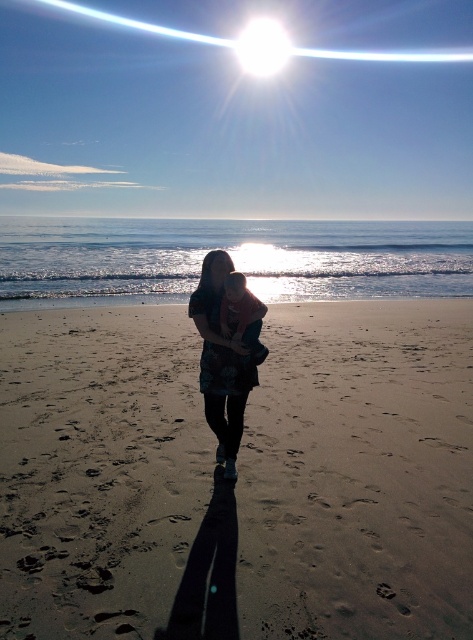
Does sandy brown at center have a greater height compared to matte blue dress at center?

In fact, sandy brown at center may be shorter than matte blue dress at center.

Does sandy brown at center have a larger size compared to matte blue dress at center?

Yes, sandy brown at center is bigger than matte blue dress at center.

At what (x,y) coordinates should I click in order to perform the action: click on sandy brown at center. Please return your answer as a coordinate pair (x, y). The height and width of the screenshot is (640, 473). Looking at the image, I should click on (238, 476).

Which of these two, matte blue dress at center or soft pink fabric baby at center, stands taller?

matte blue dress at center is taller.

Is matte blue dress at center closer to the viewer compared to soft pink fabric baby at center?

That is False.

Measure the distance between matte blue dress at center and camera.

14.74 feet

This screenshot has height=640, width=473. I want to click on matte blue dress at center, so click(227, 349).

Does sandy brown at center have a larger size compared to soft pink fabric baby at center?

Indeed, sandy brown at center has a larger size compared to soft pink fabric baby at center.

Is sandy brown at center closer to camera compared to soft pink fabric baby at center?

Yes, it is in front of soft pink fabric baby at center.

Image resolution: width=473 pixels, height=640 pixels. I want to click on sandy brown at center, so click(238, 476).